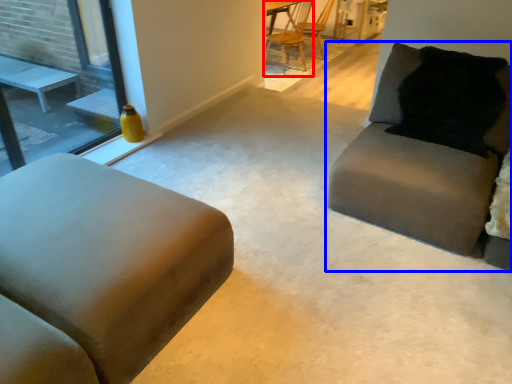
Question: Which of the following is the closest to the observer, chair (highlighted by a red box) or studio couch (highlighted by a blue box)?

Choices:
 (A) chair
 (B) studio couch

Answer: (B)